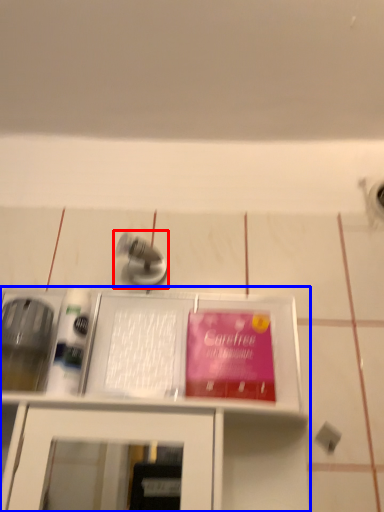
Question: Which object appears closest to the camera in this image, tap (highlighted by a red box) or furniture (highlighted by a blue box)?

Choices:
 (A) tap
 (B) furniture

Answer: (B)